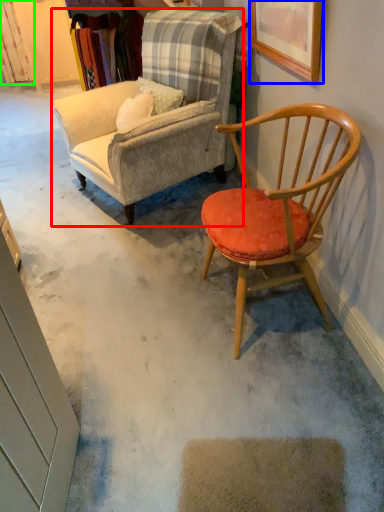
Question: Estimate the real-world distances between objects in this image. Which object is closer to chair (highlighted by a red box), picture frame (highlighted by a blue box) or curtain (highlighted by a green box)?

Choices:
 (A) picture frame
 (B) curtain

Answer: (A)